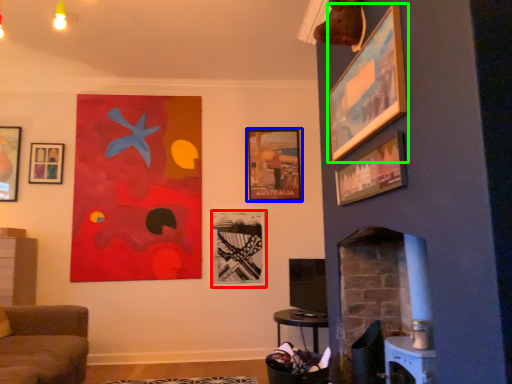
Question: Which is farther away from picture frame (highlighted by a red box)? picture frame (highlighted by a blue box) or picture frame (highlighted by a green box)?

Choices:
 (A) picture frame
 (B) picture frame

Answer: (B)